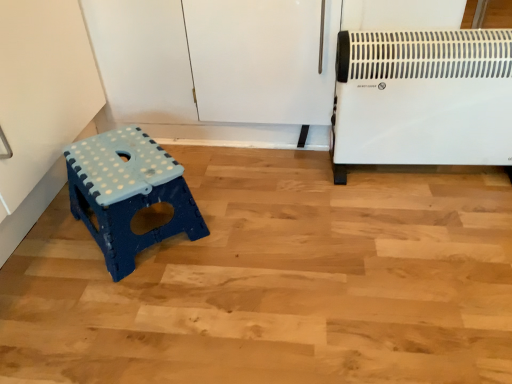
At what (x,y) coordinates should I click in order to perform the action: click on free space in front of blue plastic stool at lower left. Please return your answer as a coordinate pair (x, y). Looking at the image, I should click on (119, 317).